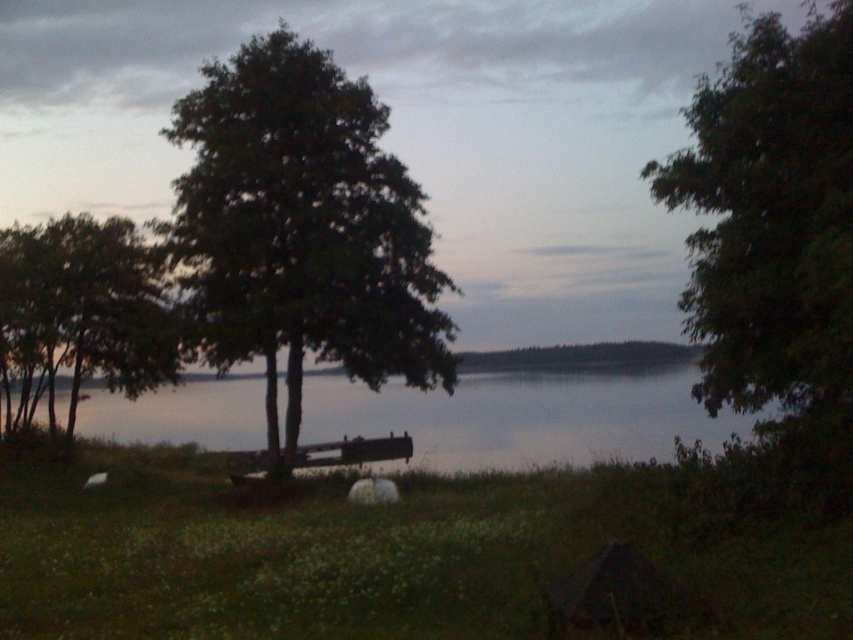
You are standing in the lakeside scene and want to walk from the wooden bench to the horizon line. There are two points marked in the image, point A at coordinates point (355,150) and point B at coordinates point (553,436). Which point should you avoid stepping on if you want to stay closer to the wooden bench?

You should avoid stepping on point B at coordinates point (553,436) because point A at coordinates point (355,150) is closer to the wooden bench.

You are planning to set up a small tent in the lakeside area. The tent requires a space that is wider than the green leafy tree at center. Can you determine if the smooth water at center provides enough width for the tent?

The smooth water at center is wider than the green leafy tree at center, so yes, the smooth water at center provides enough width for the tent.